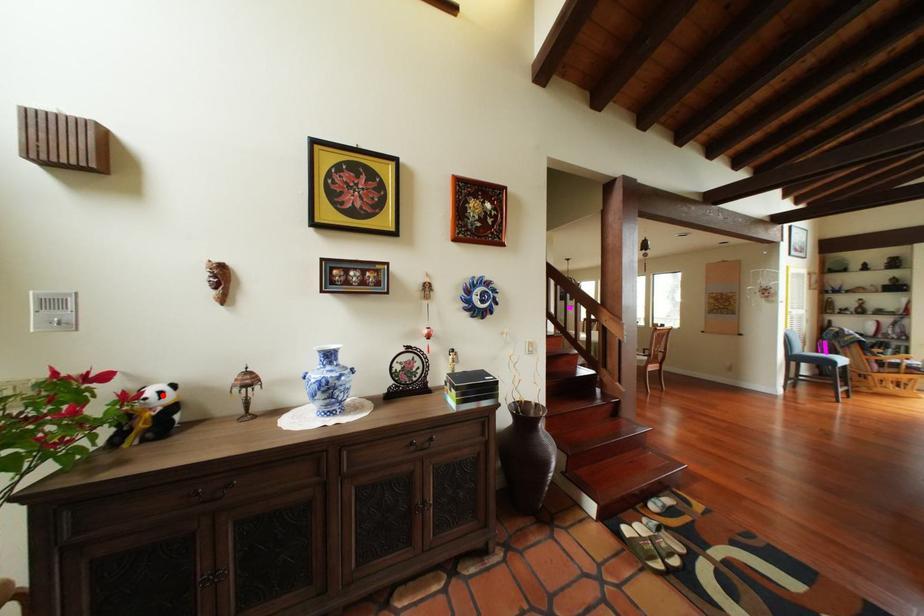
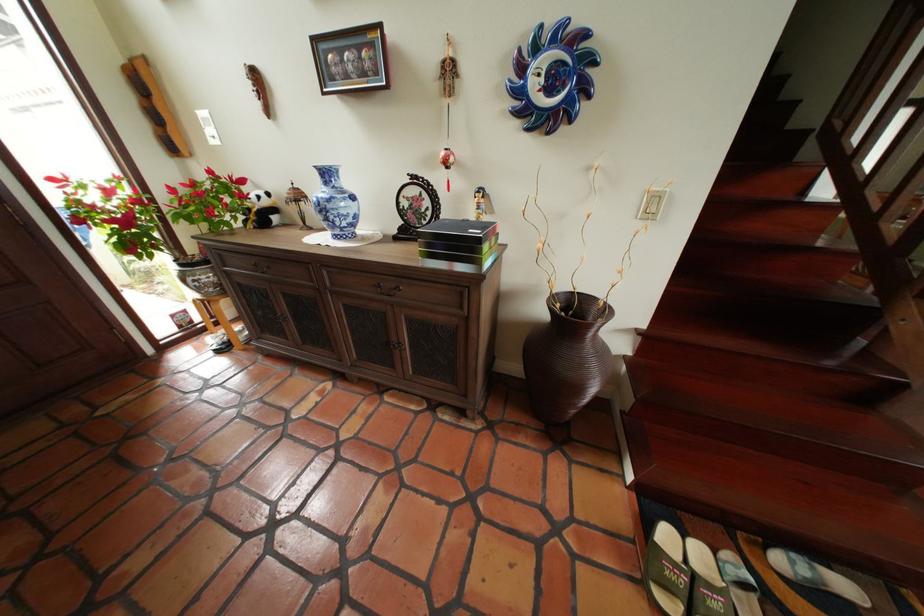
Find the pixel in the second image that matches the highlighted location in the first image.

(265, 197)